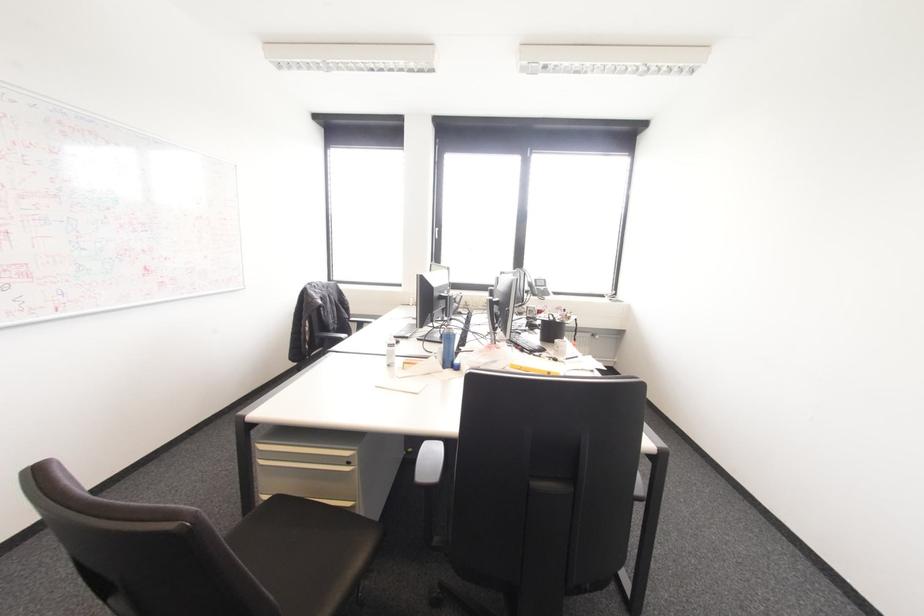
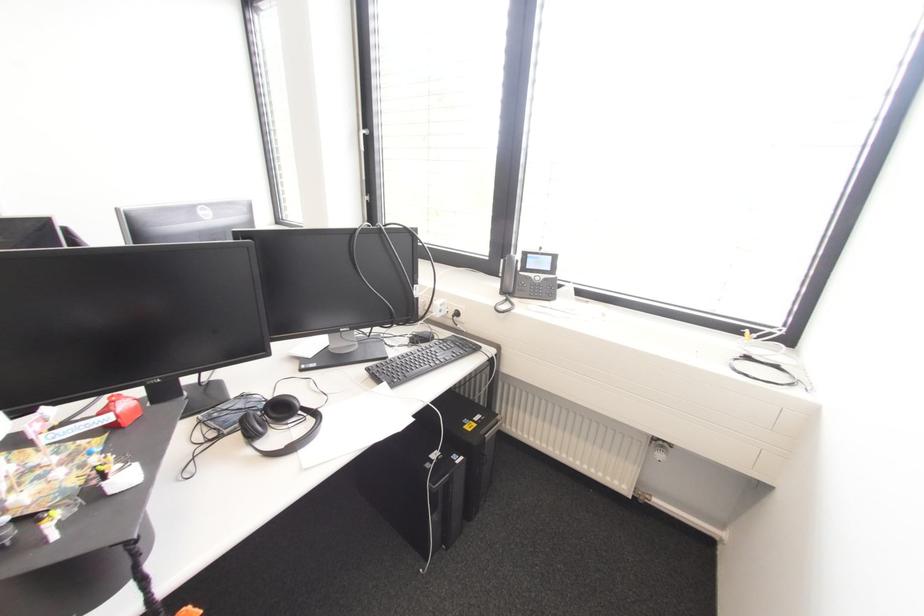
Locate, in the second image, the point that corresponds to pixel 533 294 in the first image.

(503, 292)